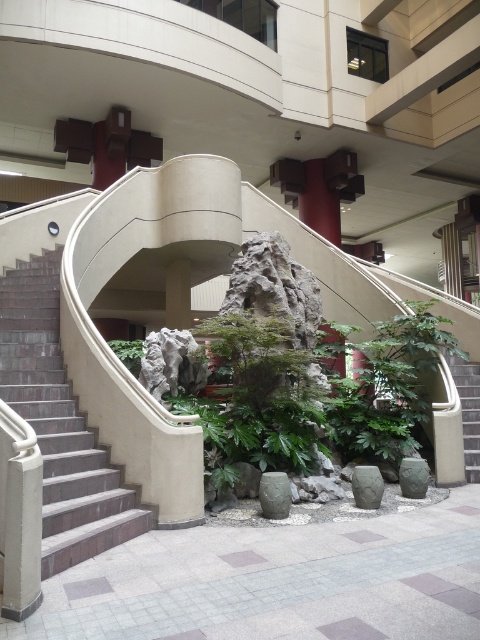
Who is positioned more to the left, brick stairs at left or green leafy plant at center?

brick stairs at left is more to the left.

Does brick stairs at left lie behind green leafy plant at center?

No.

Is point (47, 563) closer to viewer compared to point (124, 340)?

Yes, it is in front of point (124, 340).

Identify the location of brick stairs at left. This screenshot has width=480, height=640. (60, 424).